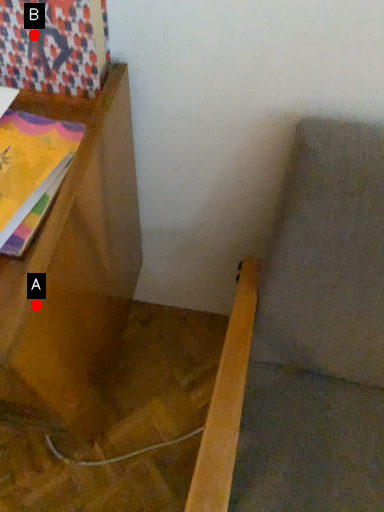
Question: Two points are circled on the image, labeled by A and B beside each circle. Which of the following is the farthest from the observer?

Choices:
 (A) A is further
 (B) B is further

Answer: (B)